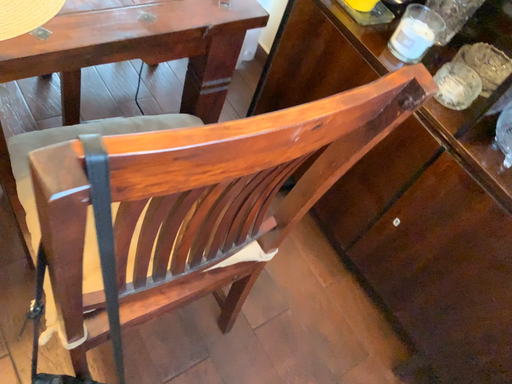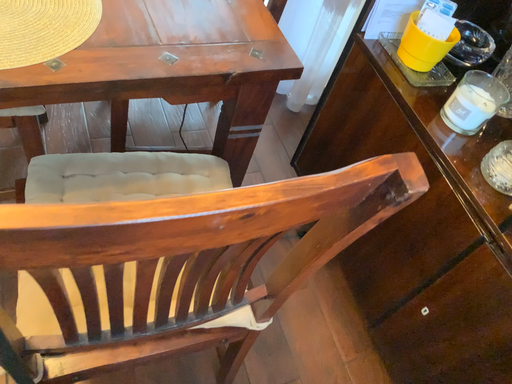
Question: How did the camera likely rotate when shooting the video?

Choices:
 (A) rotated left
 (B) rotated right

Answer: (A)